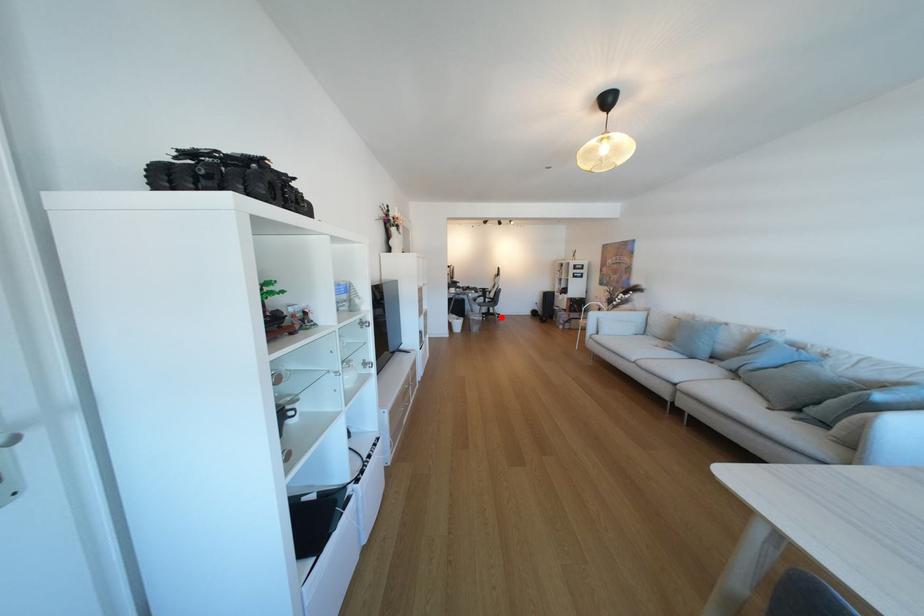
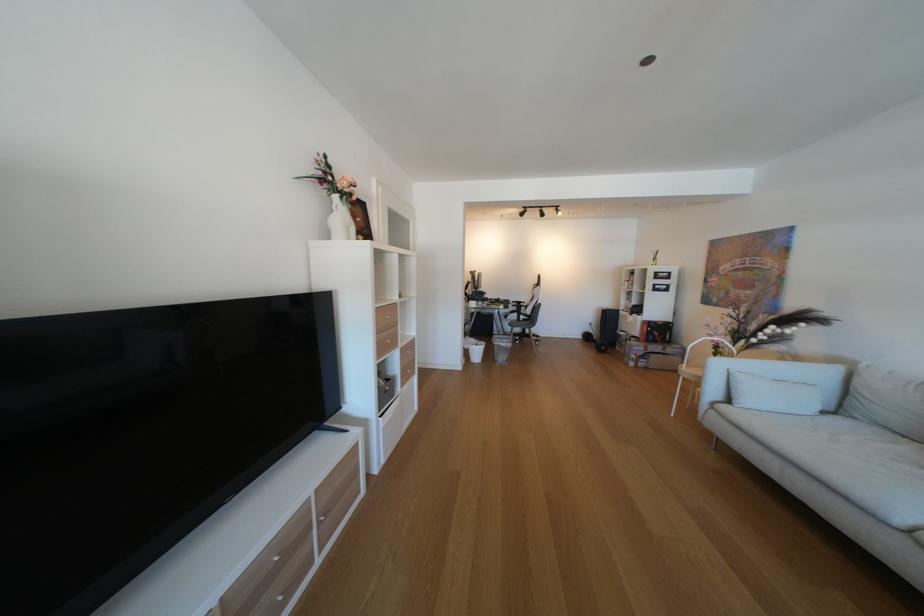
Question: A red point is marked in image1. In image2, is the corresponding 3D point closer to the camera or farther? Reply with the corresponding letter.

Choices:
 (A) The corresponding 3D point is closer.
 (B) The corresponding 3D point is farther.

Answer: (B)